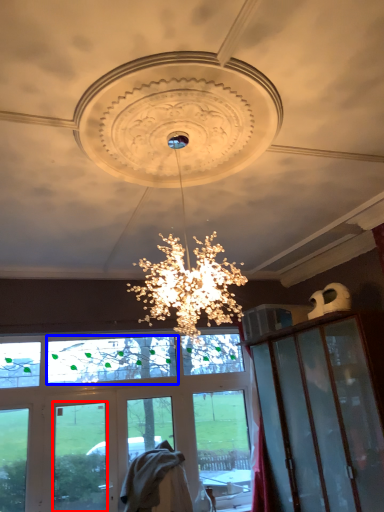
Question: Which of the following is the closest to the observer, glass window (highlighted by a red box) or window screen (highlighted by a blue box)?

Choices:
 (A) glass window
 (B) window screen

Answer: (A)